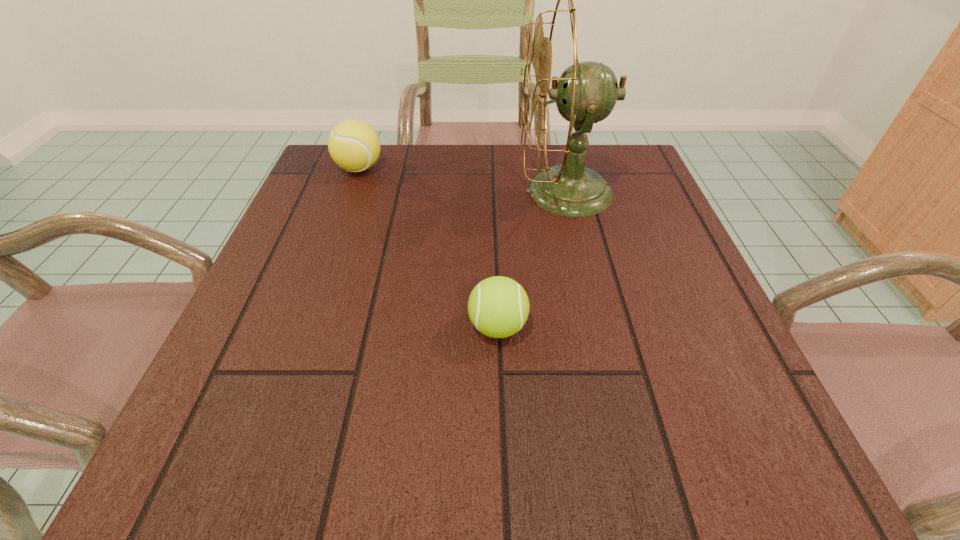
Locate an element on the screen. The height and width of the screenshot is (540, 960). fan is located at coordinates (586, 93).

This screenshot has height=540, width=960. I want to click on the rightmost object, so click(x=586, y=93).

Locate an element on the screen. The width and height of the screenshot is (960, 540). the leftmost object is located at coordinates (354, 146).

At what (x,y) coordinates should I click in order to perform the action: click on the left tennis ball. Please return your answer as a coordinate pair (x, y). The width and height of the screenshot is (960, 540). Looking at the image, I should click on (354, 146).

The height and width of the screenshot is (540, 960). What are the coordinates of `the shorter tennis ball` in the screenshot? It's located at (498, 307).

Where is `the shortest object`? This screenshot has height=540, width=960. the shortest object is located at coordinates (498, 307).

Image resolution: width=960 pixels, height=540 pixels. Find the location of `vacant area situated in front of the rightmost object, directing air flow`. vacant area situated in front of the rightmost object, directing air flow is located at coordinates (419, 191).

You are a GUI agent. You are given a task and a screenshot of the screen. Output one action in this format:
    pyautogui.click(x=<x>, y=<y>)
    Task: Click on the vacant area situated 0.370m in front of the rightmost object, directing air flow
    This screenshot has height=540, width=960.
    Given the screenshot: What is the action you would take?
    pyautogui.click(x=351, y=191)

I want to click on free space located in front of the rightmost object, directing air flow, so click(x=338, y=191).

Locate an element on the screen. The width and height of the screenshot is (960, 540). blank space located on the right of the taller tennis ball is located at coordinates (447, 168).